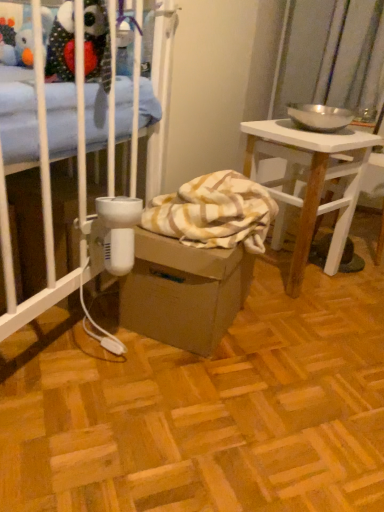
You are a GUI agent. You are given a task and a screenshot of the screen. Output one action in this format:
    pyautogui.click(x=<x>, y=<y>)
    Task: Click on the free point in front of brown cardboard box at center
    The height and width of the screenshot is (512, 384).
    Given the screenshot: What is the action you would take?
    pyautogui.click(x=193, y=391)